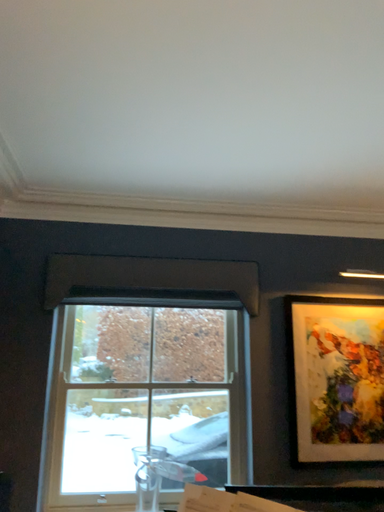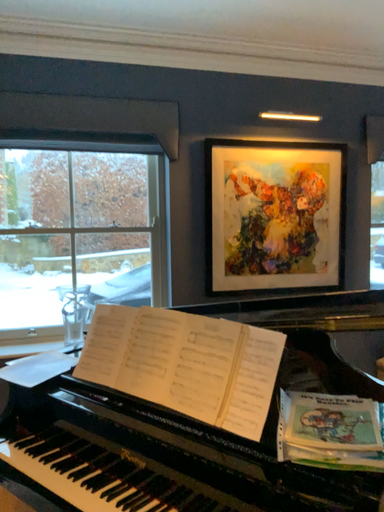
Question: Which way did the camera rotate in the video?

Choices:
 (A) rotated right
 (B) rotated left

Answer: (A)